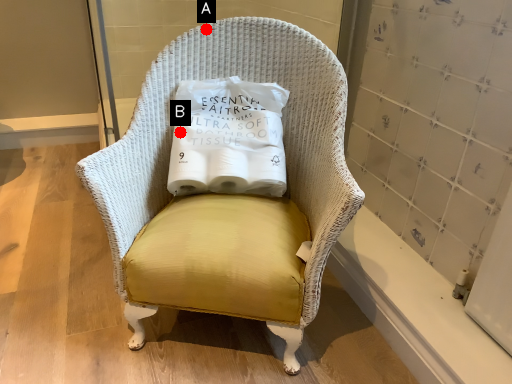
Question: Two points are circled on the image, labeled by A and B beside each circle. Among these points, which one is nearest to the camera?

Choices:
 (A) A is closer
 (B) B is closer

Answer: (B)